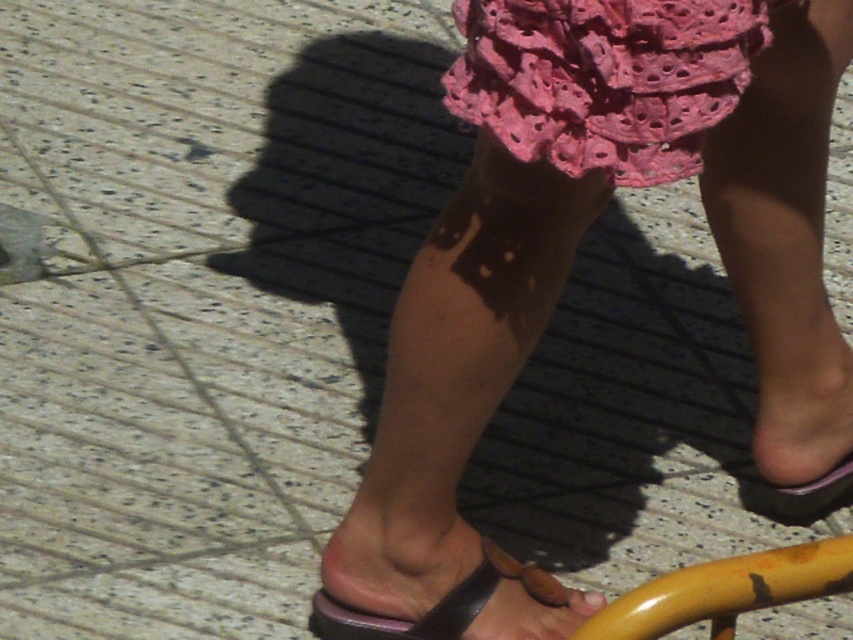
Question: Which point is farther from the camera taking this photo?

Choices:
 (A) (518, 61)
 (B) (357, 627)

Answer: (B)

Question: Can you confirm if pink lace dress at upper center is positioned to the right of black leather sandal at lower center?

Choices:
 (A) yes
 (B) no

Answer: (A)

Question: Does pink lace dress at upper center appear over black leather sandal at lower center?

Choices:
 (A) no
 (B) yes

Answer: (B)

Question: Is pink lace dress at upper center below black leather sandal at lower center?

Choices:
 (A) yes
 (B) no

Answer: (B)